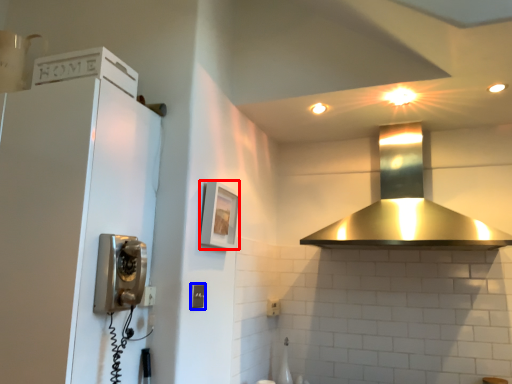
Question: Among these objects, which one is farthest to the camera, picture frame (highlighted by a red box) or light switch (highlighted by a blue box)?

Choices:
 (A) picture frame
 (B) light switch

Answer: (A)